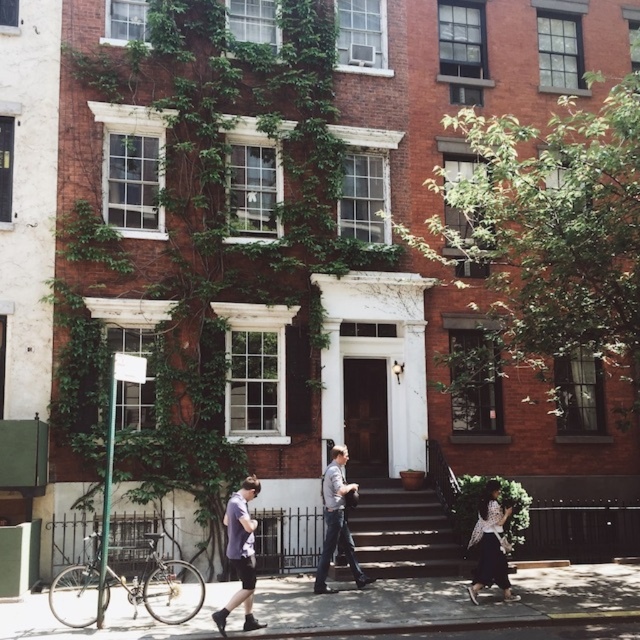
You are standing on the sidewalk in front of the three story brick building. You see a point at coordinate (337, 522). What is located at that point?

The light gray shirt at center is located at point (337, 522).

You are standing on the sidewalk in front of the building and want to go inside. Which object do you need to step onto first, the smooth concrete pavement at center or the dark brown wooden stairs at center?

You need to step onto the dark brown wooden stairs at center first because the smooth concrete pavement at center is below them, meaning the stairs are elevated and closer to the entrance.

You are a delivery person trying to reach the door of the building. You have a package that needs to be delivered to the entrance. The stairs are at the center. You are currently standing on the smooth concrete pavement at center. Which direction should you move to reach the dark brown wooden stairs at center?

The smooth concrete pavement at center is shorter than the dark brown wooden stairs at center. Since you are on the pavement, you should move towards the direction where the stairs rise upwards to reach the dark brown wooden stairs at center.